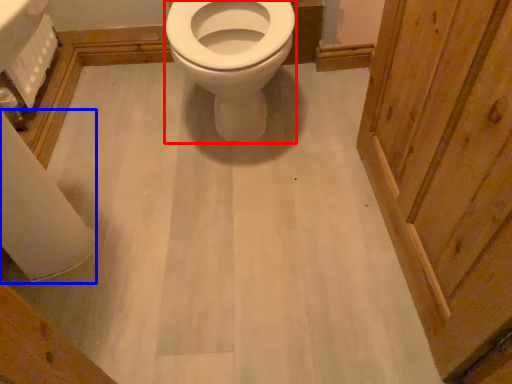
Question: Which of the following is the farthest to the observer, bidet (highlighted by a red box) or toilet paper (highlighted by a blue box)?

Choices:
 (A) bidet
 (B) toilet paper

Answer: (B)